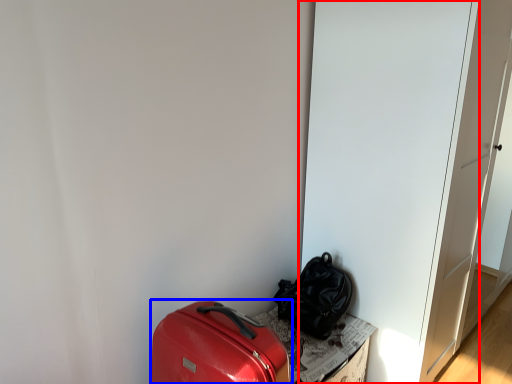
Question: Which object is closer to the camera taking this photo, door (highlighted by a red box) or luggage and bags (highlighted by a blue box)?

Choices:
 (A) door
 (B) luggage and bags

Answer: (B)